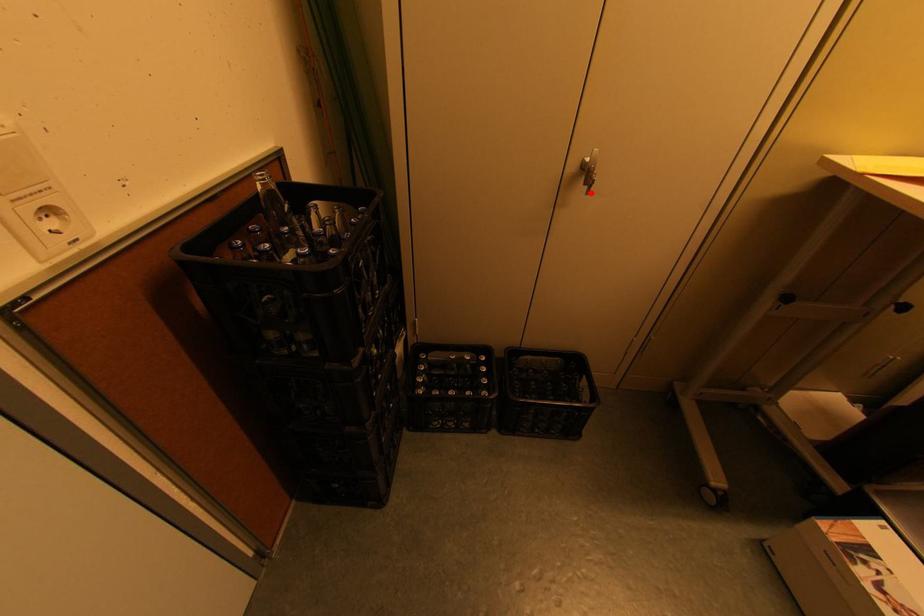
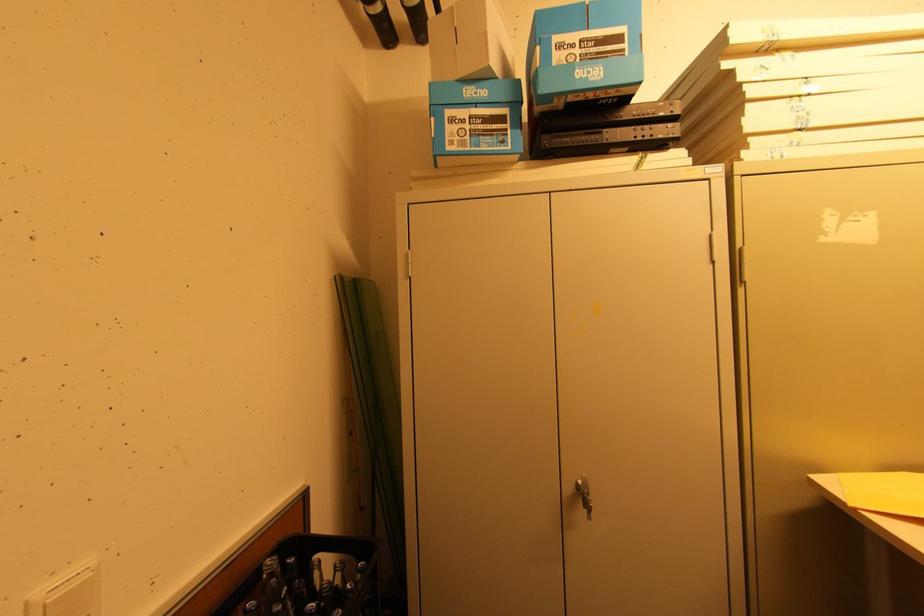
Find the pixel in the second image that matches the highlighted location in the first image.

(592, 519)